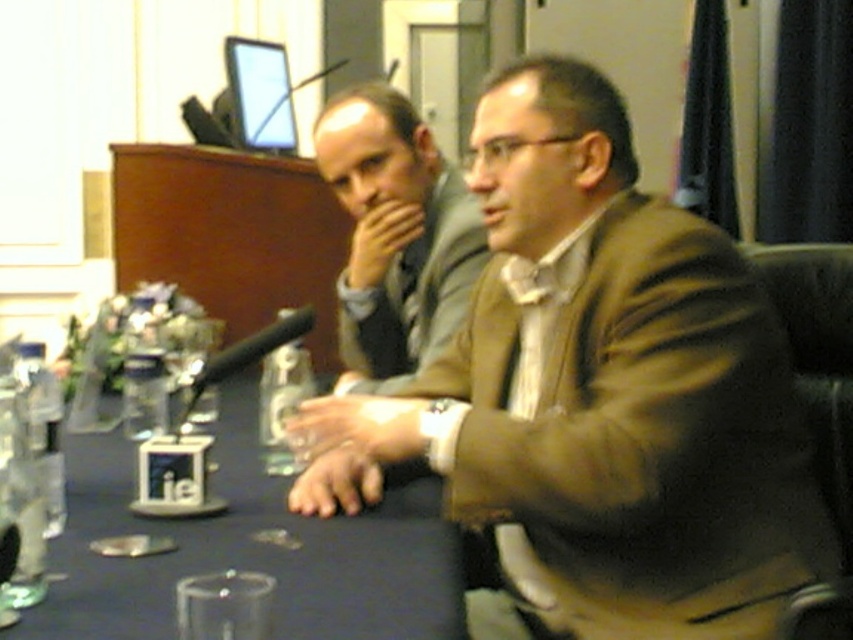
Question: Can you confirm if matte brown jacket at center is positioned above matte gray suit at center?

Choices:
 (A) yes
 (B) no

Answer: (B)

Question: Can you confirm if blue fabric table at center is bigger than matte gray suit at center?

Choices:
 (A) yes
 (B) no

Answer: (A)

Question: Among these objects, which one is nearest to the camera?

Choices:
 (A) matte gray suit at center
 (B) blue fabric table at center

Answer: (B)

Question: Which object appears closest to the camera in this image?

Choices:
 (A) matte gray suit at center
 (B) blue fabric table at center
 (C) matte brown jacket at center

Answer: (B)

Question: Among these objects, which one is nearest to the camera?

Choices:
 (A) matte brown jacket at center
 (B) blue fabric table at center

Answer: (B)

Question: Can you confirm if blue fabric table at center is positioned above matte gray suit at center?

Choices:
 (A) yes
 (B) no

Answer: (B)